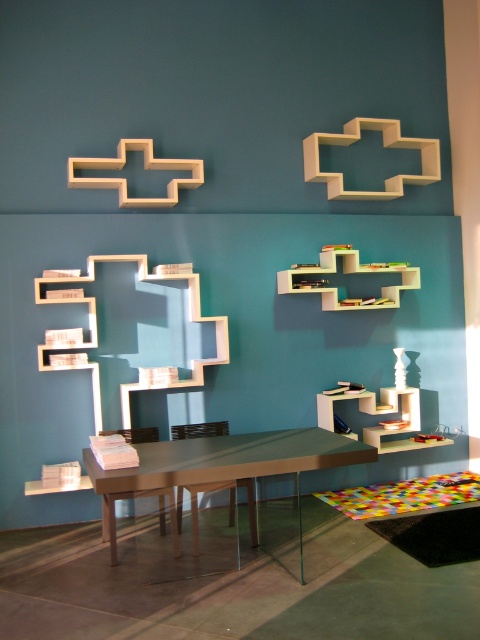
Question: Does metallic glass table at center appear under white matte shelf at upper center?

Choices:
 (A) yes
 (B) no

Answer: (A)

Question: Which point is closer to the camera?

Choices:
 (A) (259, 442)
 (B) (324, 291)

Answer: (A)

Question: Which object is farther from the camera taking this photo?

Choices:
 (A) metallic glass table at center
 (B) white matte shelf at upper center

Answer: (B)

Question: Is metallic glass table at center bigger than white matte shelf at upper center?

Choices:
 (A) yes
 (B) no

Answer: (A)

Question: In this image, where is metallic glass table at center located relative to white matte shelf at upper center?

Choices:
 (A) below
 (B) above

Answer: (A)

Question: Which point appears farthest from the camera in this image?

Choices:
 (A) (160, 456)
 (B) (330, 256)

Answer: (B)